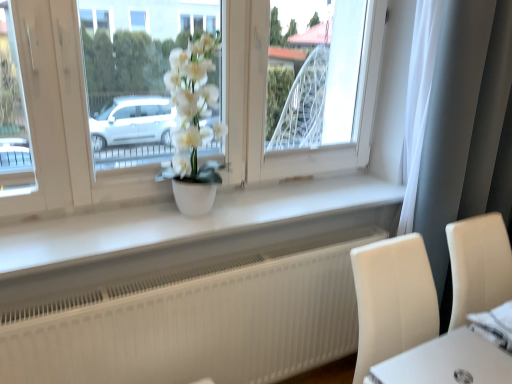
The width and height of the screenshot is (512, 384). Identify the location of vacant region to the left of white matte pot at center. (121, 228).